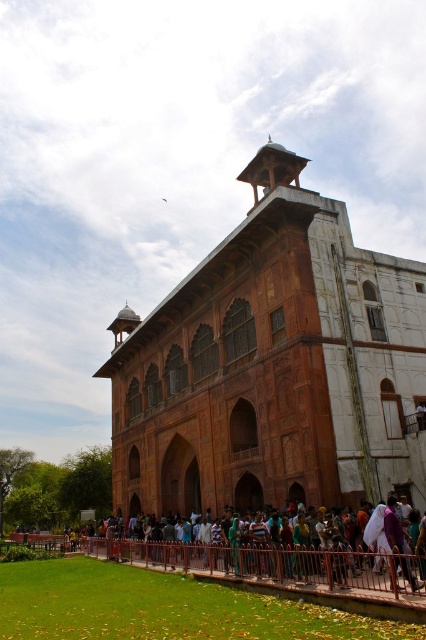
Question: Which point is closer to the camera taking this photo?

Choices:
 (A) (373, 557)
 (B) (124, 376)

Answer: (A)

Question: Does brown stone palace at center have a greater width compared to brown metal fence at lower center?

Choices:
 (A) yes
 (B) no

Answer: (A)

Question: Among these points, which one is farthest from the camera?

Choices:
 (A) (262, 566)
 (B) (313, 420)

Answer: (B)

Question: Does brown stone palace at center have a smaller size compared to brown metal fence at lower center?

Choices:
 (A) yes
 (B) no

Answer: (B)

Question: Is brown stone palace at center thinner than brown metal fence at lower center?

Choices:
 (A) no
 (B) yes

Answer: (A)